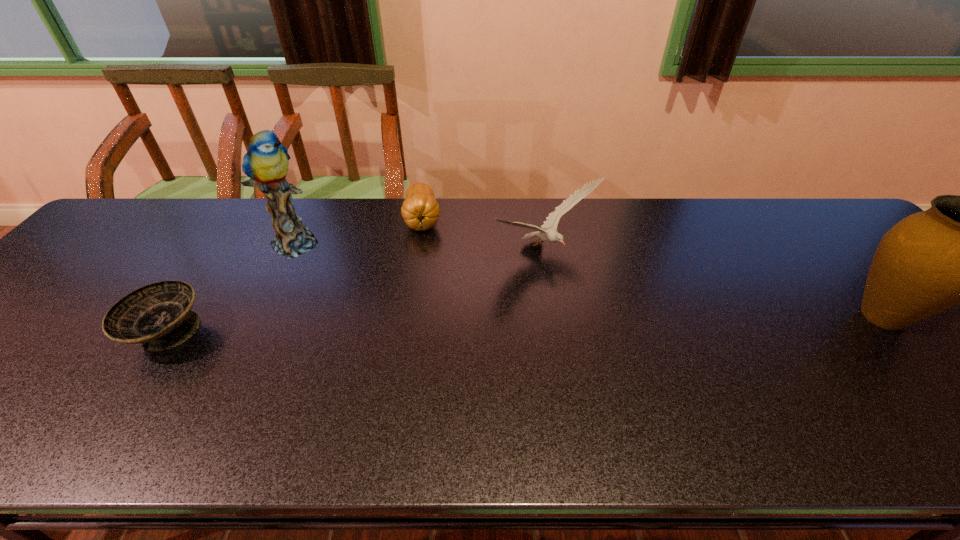
Identify the location of the shortest object. This screenshot has height=540, width=960. (158, 316).

This screenshot has height=540, width=960. Identify the location of the leftmost object. (158, 316).

Identify the location of the fourth shortest object. Image resolution: width=960 pixels, height=540 pixels. (959, 251).

This screenshot has width=960, height=540. I want to click on urn, so click(959, 251).

Where is `gourd`? gourd is located at coordinates (420, 210).

Identify the location of the third object from left to right. (420, 210).

I want to click on the second object from left to right, so click(266, 163).

This screenshot has width=960, height=540. I want to click on parrot, so click(266, 163).

At what (x,y) coordinates should I click in order to perform the action: click on gull. Please return your answer as a coordinate pair (x, y). Looking at the image, I should click on (551, 234).

The height and width of the screenshot is (540, 960). What are the coordinates of `the third shortest object` in the screenshot? It's located at pos(551,234).